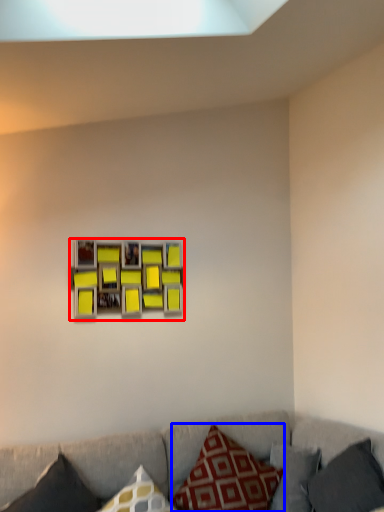
Question: Which object appears farthest to the camera in this image, picture frame (highlighted by a red box) or pillow (highlighted by a blue box)?

Choices:
 (A) picture frame
 (B) pillow

Answer: (A)